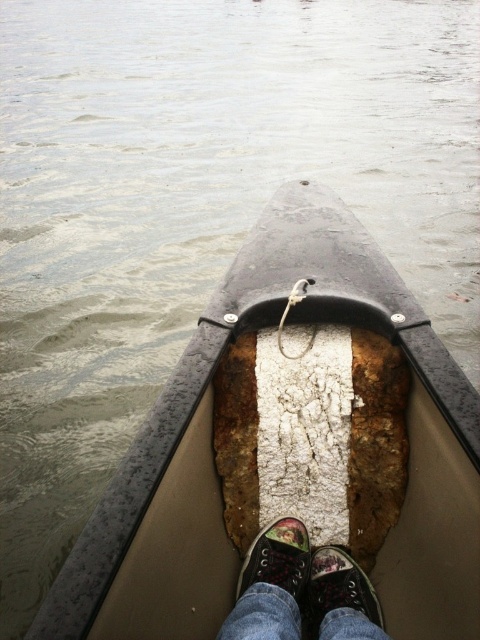
Question: From the image, what is the correct spatial relationship of denim jeans at center in relation to multicolored canvas shoe at center?

Choices:
 (A) below
 (B) above

Answer: (A)

Question: Does denim jeans at center appear on the left side of multicolored canvas shoe at center?

Choices:
 (A) no
 (B) yes

Answer: (A)

Question: Which object appears farthest from the camera in this image?

Choices:
 (A) black canvas shoe at center
 (B) multicolored canvas shoe at center
 (C) denim jeans at center

Answer: (B)

Question: Considering the real-world distances, which object is closest to the multicolored canvas shoe at center?

Choices:
 (A) rusty metal canoe at center
 (B) black canvas shoe at center

Answer: (B)

Question: Is rusty metal canoe at center wider than black canvas shoe at center?

Choices:
 (A) no
 (B) yes

Answer: (B)

Question: Among these objects, which one is farthest from the camera?

Choices:
 (A) rusty metal canoe at center
 (B) multicolored canvas shoe at center

Answer: (B)